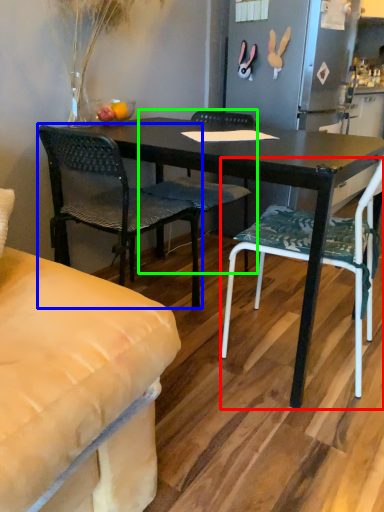
Question: Which object is the closest to the chair (highlighted by a red box)? Choose among these: chair (highlighted by a blue box) or chair (highlighted by a green box).

Choices:
 (A) chair
 (B) chair

Answer: (B)